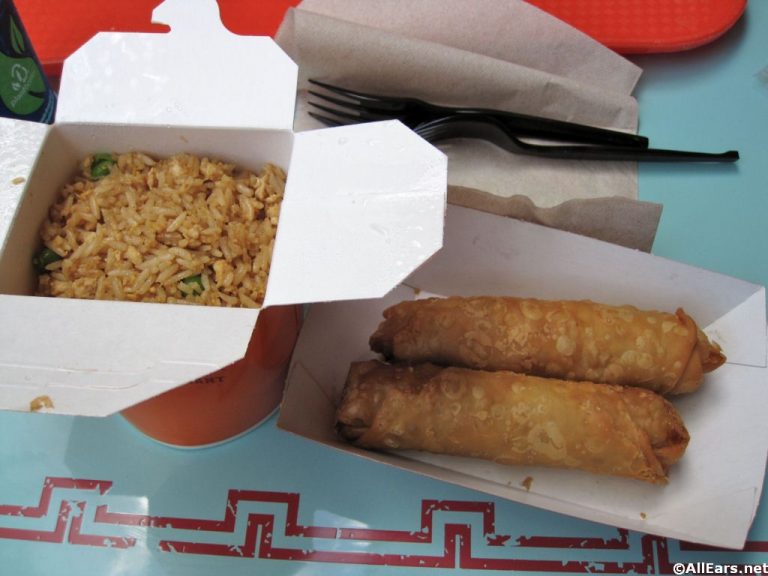
This screenshot has height=576, width=768. In order to click on red tray in this screenshot , I will do `click(613, 21)`, `click(65, 14)`.